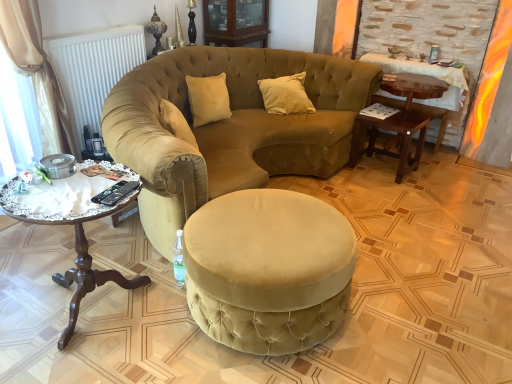
I want to click on wooden table at right, so click(x=433, y=76).

Image resolution: width=512 pixels, height=384 pixels. What do you see at coordinates (75, 229) in the screenshot?
I see `woodenwoodencoffee table at left` at bounding box center [75, 229].

Locate an element on the screen. woodenwoodencoffee table at left is located at coordinates (75, 229).

This screenshot has height=384, width=512. What do you see at coordinates (236, 22) in the screenshot? I see `matte wood cabinet at upper center` at bounding box center [236, 22].

Where is `satin beige pillow at center`? This screenshot has width=512, height=384. satin beige pillow at center is located at coordinates (286, 95).

Identify the location of beige satin curtain at left. The image size is (512, 384). (37, 72).

Which of these two, velvet beige sofa at center or woodenwoodencoffee table at left, is thinner?

Thinner between the two is woodenwoodencoffee table at left.

Is velvet beige sofa at center positioned with its back to woodenwoodencoffee table at left?

No, velvet beige sofa at center is not facing the opposite direction of woodenwoodencoffee table at left.

From their relative heights in the image, would you say velvet beige sofa at center is taller or shorter than woodenwoodencoffee table at left?

Clearly, velvet beige sofa at center is taller compared to woodenwoodencoffee table at left.

Is velvet beige sofa at center situated inside woodenwoodencoffee table at left or outside?

velvet beige sofa at center is outside woodenwoodencoffee table at left.

Which object is further away from the camera taking this photo, beige satin curtain at left or black plastic remote control at lower left?

beige satin curtain at left is behind.

Which of these two, beige satin curtain at left or black plastic remote control at lower left, is bigger?

beige satin curtain at left.

Can you confirm if beige satin curtain at left is thinner than black plastic remote control at lower left?

No, beige satin curtain at left is not thinner than black plastic remote control at lower left.

Considering the positions of objects beige satin curtain at left and black plastic remote control at lower left in the image provided, who is more to the left, beige satin curtain at left or black plastic remote control at lower left?

From the viewer's perspective, beige satin curtain at left appears more on the left side.

From the image's perspective, is woodenwoodencoffee table at left located beneath wooden side table at right?

Yes, from the image's perspective, woodenwoodencoffee table at left is below wooden side table at right.

From a real-world perspective, between woodenwoodencoffee table at left and wooden side table at right, who is vertically higher?

woodenwoodencoffee table at left.

Considering the relative sizes of woodenwoodencoffee table at left and wooden side table at right in the image provided, is woodenwoodencoffee table at left bigger than wooden side table at right?

Indeed, woodenwoodencoffee table at left has a larger size compared to wooden side table at right.

From the image's perspective, is satin beige pillow at center on velvet beige sofa at center?

Yes, from the image's perspective, satin beige pillow at center is over velvet beige sofa at center.

Which is closer, (278,77) or (347,81)?

Point (278,77) is positioned farther from the camera compared to point (347,81).

Measure the distance from satin beige pillow at center to velvet beige sofa at center.

They are 22.26 inches apart.

Is satin beige pillow at center positioned in front of velvet beige sofa at center?

No, satin beige pillow at center is behind velvet beige sofa at center.

At what (x,y) coordinates should I click in order to perform the action: click on table on the right of woodenwoodencoffee table at left. Please return your answer as a coordinate pair (x, y). Looking at the image, I should click on (398, 135).

From the image's perspective, is wooden side table at right on woodenwoodencoffee table at left?

Yes, from the image's perspective, wooden side table at right is on top of woodenwoodencoffee table at left.

Based on the photo, does wooden side table at right have a greater width compared to woodenwoodencoffee table at left?

In fact, wooden side table at right might be narrower than woodenwoodencoffee table at left.

Consider the image. What's the angular difference between velvet beige sofa at center and beige satin curtain at left's facing directions?

The facing directions of velvet beige sofa at center and beige satin curtain at left are 4.62 degrees apart.

Would you say velvet beige sofa at center is outside beige satin curtain at left?

That's correct, velvet beige sofa at center is outside of beige satin curtain at left.

Considering the positions of objects velvet beige sofa at center and beige satin curtain at left in the image provided, who is behind, velvet beige sofa at center or beige satin curtain at left?

beige satin curtain at left is behind.

Is the surface of velvet beige sofa at center in direct contact with beige satin curtain at left?

No, velvet beige sofa at center is not in contact with beige satin curtain at left.

Is wooden side table at right oriented towards matte wood cabinet at upper center?

No, wooden side table at right is not turned towards matte wood cabinet at upper center.

Does wooden side table at right have a smaller size compared to matte wood cabinet at upper center?

Indeed, wooden side table at right has a smaller size compared to matte wood cabinet at upper center.

Which is in front, point (423, 116) or point (248, 19)?

The point (423, 116) is closer.

Is wooden side table at right closer to camera compared to matte wood cabinet at upper center?

That is True.

I want to click on coffee table in front of the velvet beige sofa at center, so click(x=75, y=229).

I want to click on curtain that is above the black plastic remote control at lower left (from the image's perspective), so click(37, 72).

Estimate the real-world distances between objects in this image. Which object is closer to woodenwoodencoffee table at left, white matte radiator at upper left or wooden side table at right?

white matte radiator at upper left is positioned closer to the anchor woodenwoodencoffee table at left.

Based on their spatial positions, is satin beige pillow at center or wooden side table at right further from black plastic remote control at lower left?

wooden side table at right is further to black plastic remote control at lower left.

Considering their positions, is wooden table at right positioned further to velvet ottoman at center than white matte radiator at upper left?

wooden table at right is positioned further to the anchor velvet ottoman at center.

Estimate the real-world distances between objects in this image. Which object is further from velvet beige sofa at center, beige satin curtain at left or white matte radiator at upper left?

beige satin curtain at left lies further to velvet beige sofa at center than the other object.

In the scene shown: Which object lies nearer to the anchor point matte wood cabinet at upper center, satin beige pillow at center or velvet ottoman at center?

satin beige pillow at center is positioned closer to the anchor matte wood cabinet at upper center.

Which object lies nearer to the anchor point white matte radiator at upper left, velvet ottoman at center or wooden side table at right?

velvet ottoman at center lies closer to white matte radiator at upper left than the other object.

When comparing their distances from wooden table at right, does satin beige pillow at center or velvet beige sofa at center seem further?

The object further to wooden table at right is velvet beige sofa at center.

Looking at the image, which one is located further to velvet beige sofa at center, wooden table at right or matte wood cabinet at upper center?

matte wood cabinet at upper center.

Find the location of `remote control located between velvet ottoman at center and satin beige pillow at center in the depth direction`. remote control located between velvet ottoman at center and satin beige pillow at center in the depth direction is located at coordinates [x=115, y=193].

Image resolution: width=512 pixels, height=384 pixels. Identify the location of chair between beige satin curtain at left and wooden side table at right. (229, 128).

Where is `curtain between black plastic remote control at lower left and matte wood cabinet at upper center in the front-back direction`? This screenshot has width=512, height=384. curtain between black plastic remote control at lower left and matte wood cabinet at upper center in the front-back direction is located at coordinates (37, 72).

You are a GUI agent. You are given a task and a screenshot of the screen. Output one action in this format:
    pyautogui.click(x=<x>, y=<y>)
    Task: Click on the pillow between velvet ottoman at center and matte wood cabinet at upper center from front to back
    The width and height of the screenshot is (512, 384).
    Given the screenshot: What is the action you would take?
    coord(286,95)